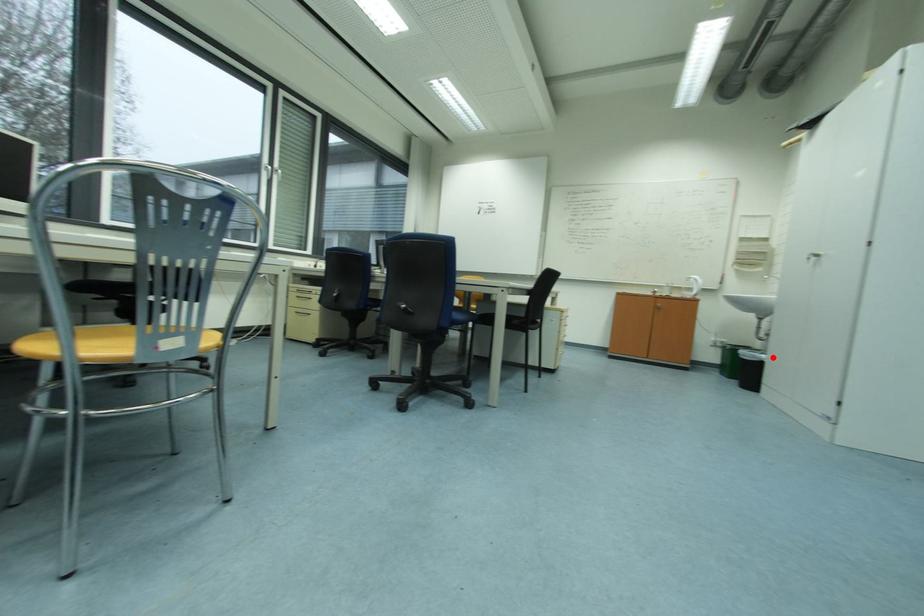
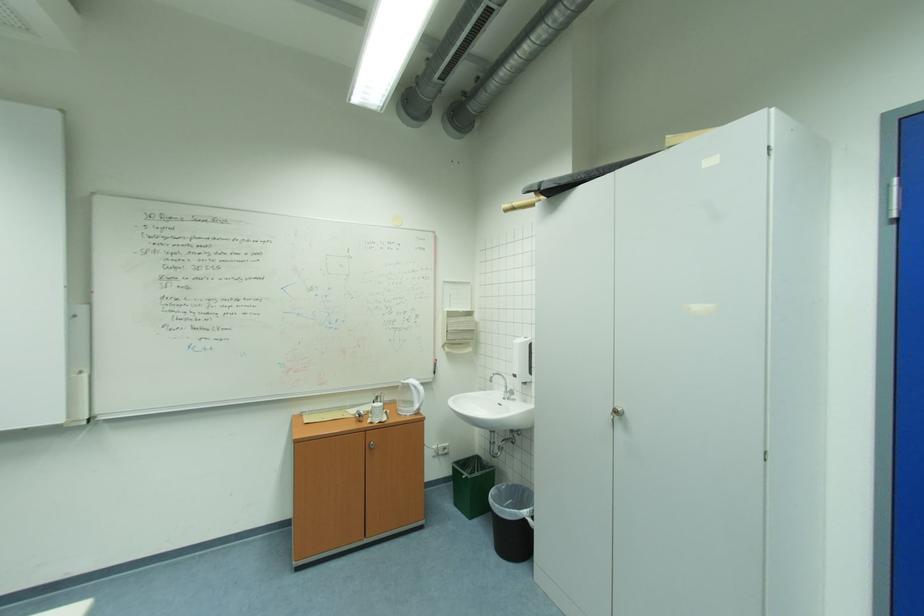
Question: I am providing you with two images of the same scene from different viewpoints. Image1 has a red point marked. In image2, the corresponding 3D location appears at what relative position? Reply with the corresponding letter.

Choices:
 (A) Closer
 (B) Farther

Answer: (A)